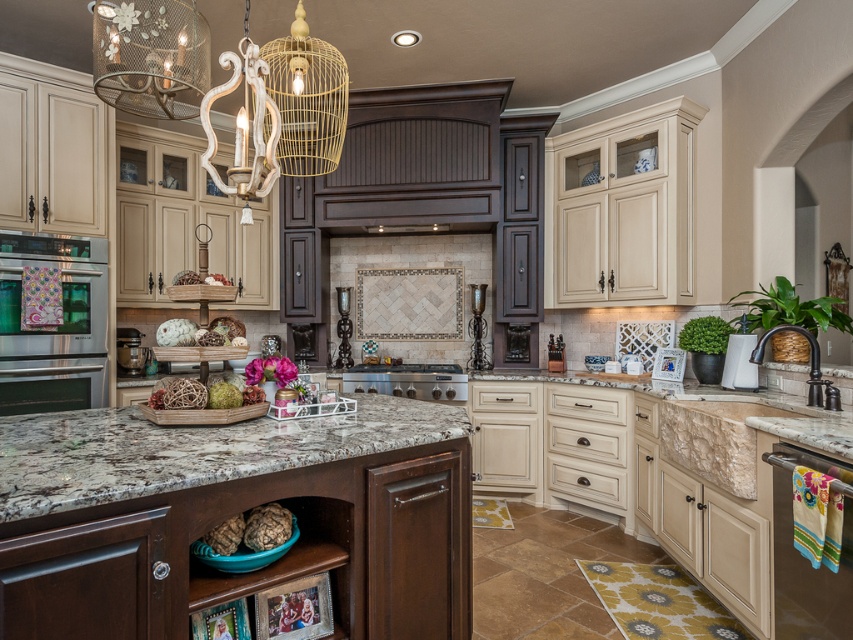
You are standing in the kitchen and want to reach the point marked at coordinates (357, 413). If your arm can extend 2 meters, can you reach that point without moving closer?

The point at coordinates (357, 413) is 2.35 meters away from the camera. Since your arm can only extend 2 meters, you cannot reach that point without moving closer.